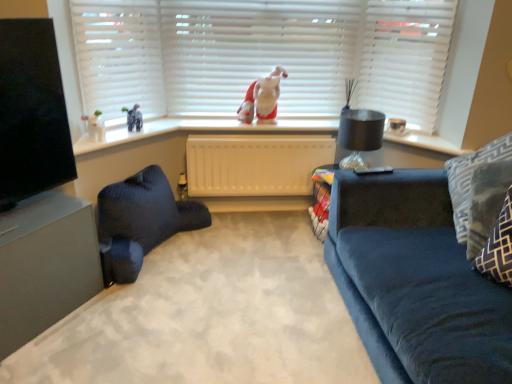
Describe the element at coordinates (262, 97) in the screenshot. I see `fuzzy fabric santa at center` at that location.

Describe the element at coordinates (31, 112) in the screenshot. The height and width of the screenshot is (384, 512). I see `black matte tv at left` at that location.

Identify the location of velvet blue couch at right, marked as the first studio couch in a right-to-left arrangement. (415, 281).

This screenshot has height=384, width=512. Identify the location of dark blue fabric studio couch at lower left, the 1th studio couch when ordered from left to right. (140, 222).

The height and width of the screenshot is (384, 512). What do you see at coordinates (405, 58) in the screenshot?
I see `white matte shutter at upper right` at bounding box center [405, 58].

Image resolution: width=512 pixels, height=384 pixels. What do you see at coordinates (479, 191) in the screenshot? I see `patterned fabric pillow at right, marked as the first pillow in a back-to-front arrangement` at bounding box center [479, 191].

The height and width of the screenshot is (384, 512). Find the location of `patterned fabric pillow at right, marked as the first pillow in a back-to-front arrangement`. patterned fabric pillow at right, marked as the first pillow in a back-to-front arrangement is located at coordinates (479, 191).

The width and height of the screenshot is (512, 384). Identify the location of fuzzy fabric santa at center. (262, 97).

The image size is (512, 384). Identify the location of studio couch on the left side of white matte shutter at upper right. (140, 222).

Is white matte shutter at upper right touching dark blue fabric studio couch at lower left, the 1th studio couch when ordered from left to right?

No, white matte shutter at upper right is not in contact with dark blue fabric studio couch at lower left, the 1th studio couch when ordered from left to right.

Choose the correct answer: Is white matte shutter at upper right inside dark blue fabric studio couch at lower left, the 1th studio couch when ordered from left to right, or outside it?

white matte shutter at upper right exists outside the volume of dark blue fabric studio couch at lower left, the 1th studio couch when ordered from left to right.

Where is `shutter that is above the white plastic window sill at center (from a real-world perspective)`? The image size is (512, 384). shutter that is above the white plastic window sill at center (from a real-world perspective) is located at coordinates (405, 58).

Is white plastic window sill at center directly adjacent to white matte shutter at upper right?

No, white plastic window sill at center is not with white matte shutter at upper right.

In the scene shown: Which is more to the left, white plastic window sill at center or white matte shutter at upper right?

white plastic window sill at center.

Which of these two, matte gray entertainment center at left or white matte radiator at center, is bigger?

matte gray entertainment center at left is bigger.

Which object is positioned more to the right, matte gray entertainment center at left or white matte radiator at center?

white matte radiator at center.

Which is more distant, (x=39, y=229) or (x=289, y=144)?

The point (x=289, y=144) is farther.

Consider the image. Can white matte radiator at center be found inside matte gray entertainment center at left?

No.

Considering the relative sizes of white matte blinds at upper center and patterned fabric pillow at right, the 2th pillow positioned from the back, in the image provided, is white matte blinds at upper center thinner than patterned fabric pillow at right, the 2th pillow positioned from the back,?

No, white matte blinds at upper center is not thinner than patterned fabric pillow at right, the 2th pillow positioned from the back.

This screenshot has width=512, height=384. What are the coordinates of `blind behind the patterned fabric pillow at right, the 2th pillow positioned from the back` in the screenshot? It's located at (258, 52).

What's the angular difference between white matte blinds at upper center and patterned fabric pillow at right, the 2th pillow positioned from the back,'s facing directions?

The angular difference between white matte blinds at upper center and patterned fabric pillow at right, the 2th pillow positioned from the back, is 90.3 degrees.

Based on the photo, is patterned fabric pillow at right, the 2th pillow positioned from the back, surrounded by white matte blinds at upper center?

No.

Is black glass lamp at upper right to the left or to the right of velvet blue couch at right, placed as the 2th studio couch when sorted from left to right, in the image?

Clearly, black glass lamp at upper right is on the left of velvet blue couch at right, placed as the 2th studio couch when sorted from left to right, in the image.

Considering the sizes of objects black glass lamp at upper right and velvet blue couch at right, marked as the first studio couch in a right-to-left arrangement, in the image provided, who is shorter, black glass lamp at upper right or velvet blue couch at right, marked as the first studio couch in a right-to-left arrangement,?

black glass lamp at upper right is shorter.

Does black glass lamp at upper right have a smaller size compared to velvet blue couch at right, placed as the 2th studio couch when sorted from left to right?

Yes, black glass lamp at upper right is smaller than velvet blue couch at right, placed as the 2th studio couch when sorted from left to right.

What's the angular difference between black glass lamp at upper right and velvet blue couch at right, placed as the 2th studio couch when sorted from left to right,'s facing directions?

There is a 4.62-degree angle between the facing directions of black glass lamp at upper right and velvet blue couch at right, placed as the 2th studio couch when sorted from left to right.

Who is shorter, white matte blinds at upper center or velvet dark blue armchair at lower left?

With less height is velvet dark blue armchair at lower left.

Is white matte blinds at upper center far from velvet dark blue armchair at lower left?

white matte blinds at upper center is positioned a significant distance from velvet dark blue armchair at lower left.

Does point (82, 64) come farther from viewer compared to point (198, 358)?

Yes, it is behind point (198, 358).

How many degrees apart are the facing directions of white matte blinds at upper center and velvet dark blue armchair at lower left?

The angle between the facing direction of white matte blinds at upper center and the facing direction of velvet dark blue armchair at lower left is 137 degrees.

Is dark blue fabric studio couch at lower left, the 2th studio couch in the right-to-left sequence, oriented towards white matte blinds at upper center?

No.

Does point (122, 250) lie behind point (234, 47)?

No, it is not.

Is dark blue fabric studio couch at lower left, the 1th studio couch when ordered from left to right, beside white matte blinds at upper center?

dark blue fabric studio couch at lower left, the 1th studio couch when ordered from left to right, and white matte blinds at upper center are not in contact.

Between dark blue fabric studio couch at lower left, the 2th studio couch in the right-to-left sequence, and white matte blinds at upper center, which one appears on the left side from the viewer's perspective?

dark blue fabric studio couch at lower left, the 2th studio couch in the right-to-left sequence, is more to the left.

The image size is (512, 384). In order to click on shutter above the dark blue fabric studio couch at lower left, the 1th studio couch when ordered from left to right (from the image's perspective) in this screenshot , I will do `click(405, 58)`.

Locate an element on the screen. window sill below the white matte shutter at upper right (from a real-world perspective) is located at coordinates (195, 130).

From the image, which object appears to be farther from white matte blinds at upper center, fuzzy fabric santa at center or white matte radiator at center?

fuzzy fabric santa at center is positioned further to the anchor white matte blinds at upper center.

In the scene shown: Looking at the image, which one is located closer to black glass lamp at upper right, matte gray entertainment center at left or white matte blinds at upper center?

Among the two, white matte blinds at upper center is located nearer to black glass lamp at upper right.

Which object lies further to the anchor point black glass lamp at upper right, matte gray entertainment center at left or white matte blinds at upper center?

matte gray entertainment center at left is further to black glass lamp at upper right.

Based on the photo, which object lies nearer to the anchor point white matte blinds at upper center, fuzzy fabric santa at center or black matte tv at left?

black matte tv at left is positioned closer to the anchor white matte blinds at upper center.

Looking at the image, which one is located closer to velvet dark blue armchair at lower left, white matte blinds at upper center or black matte tv at left?

The object closer to velvet dark blue armchair at lower left is black matte tv at left.

Considering their positions, is velvet dark blue armchair at lower left positioned further to white plastic window sill at center than dark blue fabric studio couch at lower left, the 2th studio couch in the right-to-left sequence?

velvet dark blue armchair at lower left is positioned further to the anchor white plastic window sill at center.

Which object lies further to the anchor point velvet blue couch at right, placed as the 2th studio couch when sorted from left to right, white matte blinds at upper center or fuzzy fabric santa at center?

The object further to velvet blue couch at right, placed as the 2th studio couch when sorted from left to right, is fuzzy fabric santa at center.

Estimate the real-world distances between objects in this image. Which object is closer to black glass lamp at upper right, white matte radiator at center or velvet dark blue armchair at lower left?

Among the two, white matte radiator at center is located nearer to black glass lamp at upper right.

The width and height of the screenshot is (512, 384). I want to click on lamp between dark blue fabric studio couch at lower left, the 1th studio couch when ordered from left to right, and patterned fabric pillow at right, marked as the first pillow in a back-to-front arrangement, from left to right, so click(x=359, y=135).

Find the location of a particular element. This screenshot has height=384, width=512. shutter positioned between velvet blue couch at right, placed as the 2th studio couch when sorted from left to right, and white matte blinds at upper center from near to far is located at coordinates (405, 58).

Image resolution: width=512 pixels, height=384 pixels. Find the location of `plain located between black matte tv at left and fuzzy fabric santa at center in the depth direction`. plain located between black matte tv at left and fuzzy fabric santa at center in the depth direction is located at coordinates (x=210, y=315).

In order to click on curtain between white matte blinds at upper center and velvet dark blue armchair at lower left from top to bottom in this screenshot , I will do `click(119, 55)`.